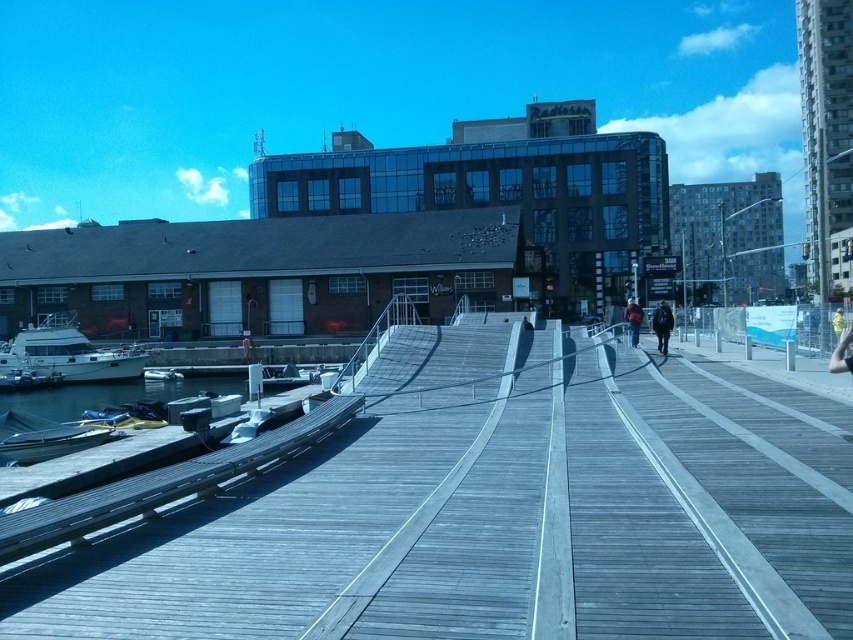
You are standing on the wooden walkway and looking towards the dock. There is a white glossy boat at lower left and a dark blue jacket at center. Which object is closer to you?

The white glossy boat at lower left is closer to you because the dark blue jacket at center is behind it.

You are standing at the point labeled as point (495, 513) in the image. What object are you standing on?

You are standing on the wooden planks at center.